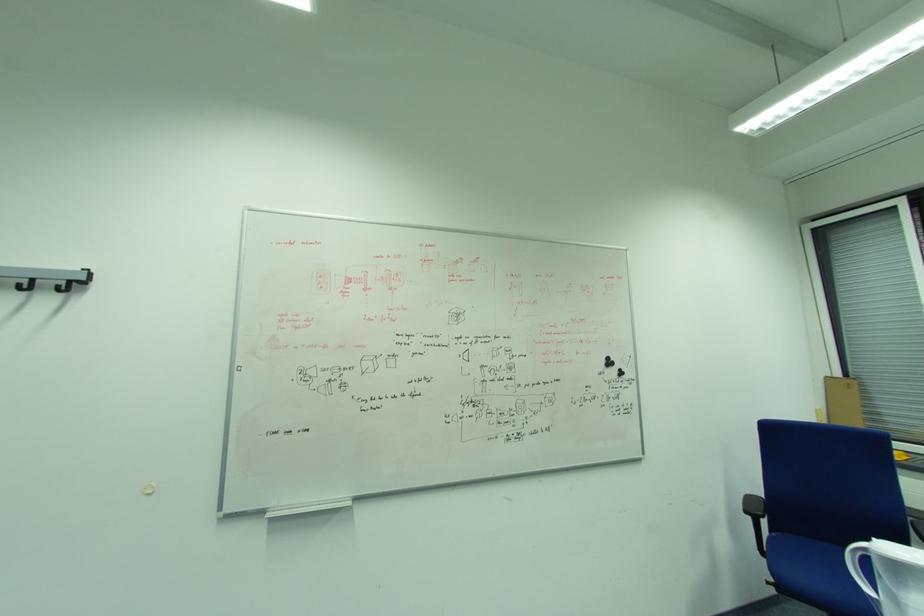
Locate an element on the screen. The height and width of the screenshot is (616, 924). black wall hook is located at coordinates (25, 285).